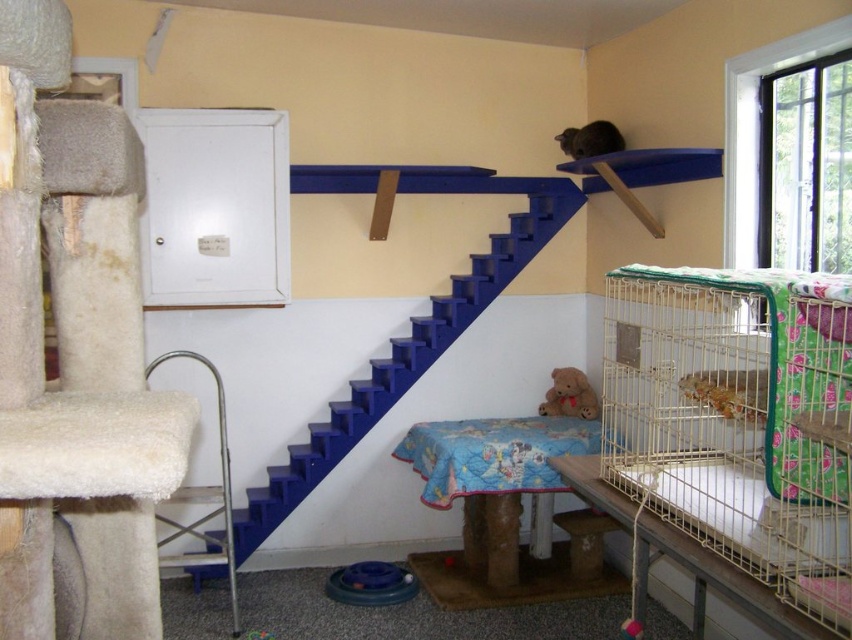
You are a cat owner who wants to place a new toy in the room. You have a brown plush teddy bear at lower center and a brown furry cat at upper center. Which object is smaller and better suited for a small cat toy?

The brown plush teddy bear at lower center is smaller than the brown furry cat at upper center, making it better suited for a small cat toy.

You are a cat owner who wants to place a new toy in the room. The brown plush teddy bear at lower center and the brown furry cat at upper center are already present. Which object takes up more horizontal space in the room?

The brown furry cat at upper center takes up more horizontal space than the brown plush teddy bear at lower center because the teddy bear has a lesser width compared to the cat.